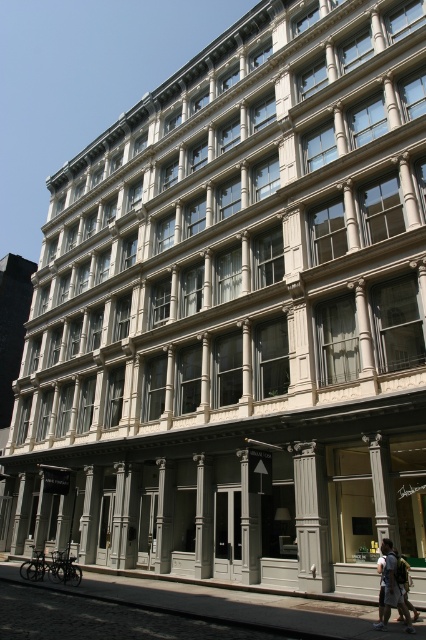
Is gray concrete column at center to the left of gray stone column at center from the viewer's perspective?

In fact, gray concrete column at center is to the right of gray stone column at center.

Which is below, gray concrete column at center or gray stone column at center?

gray stone column at center is lower down.

Where is `gray concrete column at center`? The height and width of the screenshot is (640, 426). gray concrete column at center is located at coordinates [204, 516].

Find the location of a particular element. The width and height of the screenshot is (426, 640). gray concrete column at center is located at coordinates (204, 516).

Consider the image. Who is taller, gray concrete column at center or gray stone pillar at center?

gray concrete column at center is taller.

Does gray concrete column at center have a greater height compared to gray stone pillar at center?

Correct, gray concrete column at center is much taller as gray stone pillar at center.

What do you see at coordinates (204, 516) in the screenshot? I see `gray concrete column at center` at bounding box center [204, 516].

Find the location of a particular element. This screenshot has width=426, height=640. gray concrete column at center is located at coordinates (204, 516).

Can you confirm if white painted wood column at center is thinner than gray stone column at center?

In fact, white painted wood column at center might be wider than gray stone column at center.

Which is behind, point (328, 541) or point (164, 461)?

The point (164, 461) is more distant.

Measure the distance between point (314, 576) and camera.

Point (314, 576) is 21.57 meters away from camera.

Locate an element on the screen. The image size is (426, 640). white painted wood column at center is located at coordinates (310, 516).